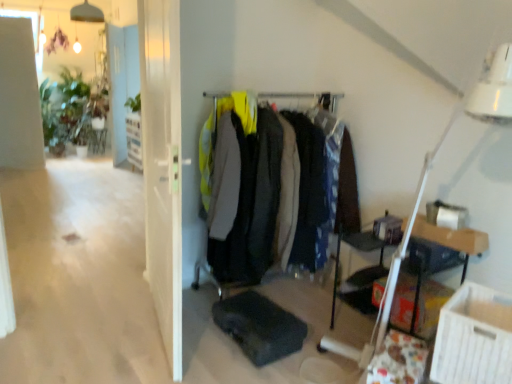
What do you see at coordinates (163, 167) in the screenshot? The height and width of the screenshot is (384, 512). I see `transparent glass door at center` at bounding box center [163, 167].

In order to click on white plastic table lamp at upper right in this screenshot , I will do `click(426, 181)`.

Describe the element at coordinates (134, 140) in the screenshot. The width and height of the screenshot is (512, 384). I see `white glossy shelf at upper center` at that location.

What is the approximate width of white cardboard box at lower right?

It is 14.36 inches.

What do you see at coordinates (452, 238) in the screenshot? I see `wooden table at right` at bounding box center [452, 238].

The width and height of the screenshot is (512, 384). Identify the location of matte black coat rack at center. (306, 98).

You are a GUI agent. You are given a task and a screenshot of the screen. Output one action in this format:
    pyautogui.click(x=<x>, y=<y>)
    Task: Click on the door located above the matte black coat rack at center (from the image's perspective)
    The width and height of the screenshot is (512, 384).
    Given the screenshot: What is the action you would take?
    pyautogui.click(x=117, y=91)

What's the angular difference between white glossy door at upper center and matte black coat rack at center's facing directions?

There is a 65-degree angle between the facing directions of white glossy door at upper center and matte black coat rack at center.

Which is in front, point (115, 147) or point (199, 260)?

Positioned in front is point (199, 260).

Can you confirm if white glossy door at upper center is shorter than matte black coat rack at center?

No, white glossy door at upper center is not shorter than matte black coat rack at center.

From the image's perspective, is white glossy door at upper center positioned above or below wooden table at right?

white glossy door at upper center is above wooden table at right.

Is white glossy door at upper center turned away from wooden table at right?

No, wooden table at right is not at the back of white glossy door at upper center.

Are white glossy door at upper center and wooden table at right making contact?

There is a gap between white glossy door at upper center and wooden table at right.

Considering the sizes of objects white glossy door at upper center and wooden table at right in the image provided, who is taller, white glossy door at upper center or wooden table at right?

Standing taller between the two is white glossy door at upper center.

Which is correct: transparent glass door at center is inside white cardboard box at lower right, or outside of it?

transparent glass door at center is spatially situated outside white cardboard box at lower right.

Locate an element on the screen. The width and height of the screenshot is (512, 384). cardboard box located below the transparent glass door at center (from the image's perspective) is located at coordinates (474, 338).

From a real-world perspective, is transparent glass door at center positioned over white cardboard box at lower right based on gravity?

Yes, from a real-world perspective, transparent glass door at center is on top of white cardboard box at lower right.

Is wooden table at right inside or outside of white glossy shelf at upper center?

wooden table at right is located beyond the bounds of white glossy shelf at upper center.

From a real-world perspective, which is physically above, wooden table at right or white glossy shelf at upper center?

white glossy shelf at upper center, from a real-world perspective.

Is there a large distance between wooden table at right and white glossy shelf at upper center?

That's right, there is a large distance between wooden table at right and white glossy shelf at upper center.

From the picture: Considering the sizes of objects wooden table at right and white glossy shelf at upper center in the image provided, who is shorter, wooden table at right or white glossy shelf at upper center?

wooden table at right is shorter.

From a real-world perspective, which object rests below the other?

white plastic table lamp at upper right is physically lower.

Is point (399, 246) closer or farther from the camera than point (114, 56)?

Point (399, 246) is closer to the camera than point (114, 56).

Could you tell me if white plastic table lamp at upper right is facing white glossy door at upper center?

No.

Who is shorter, white plastic table lamp at upper right or white glossy door at upper center?

Standing shorter between the two is white plastic table lamp at upper right.

What's the angular difference between matte black coat rack at center and green matte plant at upper left's facing directions?

They differ by 83.3 degrees in their facing directions.

Is matte black coat rack at center with green matte plant at upper left?

No.

Locate an element on the screen. This screenshot has height=384, width=512. closet below the green matte plant at upper left (from the image's perspective) is located at coordinates (306, 98).

Is white glossy door at upper center beside white cardboard box at lower right?

No, white glossy door at upper center is not in contact with white cardboard box at lower right.

Consider the image. Does white glossy door at upper center appear on the left side of white cardboard box at lower right?

Yes, white glossy door at upper center is to the left of white cardboard box at lower right.

Considering the sizes of white glossy door at upper center and white cardboard box at lower right in the image, is white glossy door at upper center bigger or smaller than white cardboard box at lower right?

white glossy door at upper center is bigger than white cardboard box at lower right.

Locate an element on the screen. This screenshot has height=384, width=512. cardboard box below the white glossy door at upper center (from a real-world perspective) is located at coordinates (474, 338).

Identify the location of door above the matte black coat rack at center (from the image's perspective). This screenshot has height=384, width=512. (117, 91).

I want to click on table that is under the white glossy door at upper center (from a real-world perspective), so click(452, 238).

Based on their spatial positions, is green matte plant at upper left or white glossy door at upper center further from white plastic table lamp at upper right?

Result: white glossy door at upper center lies further to white plastic table lamp at upper right than the other object.

Considering their positions, is green matte plant at upper left positioned further to wooden table at right than transparent glass door at center?

green matte plant at upper left is positioned further to the anchor wooden table at right.

When comparing their distances from matte black coat rack at center, does white glossy door at upper center or wooden table at right seem closer?

wooden table at right.

Based on their spatial positions, is white plastic table lamp at upper right or matte black coat rack at center closer to white glossy door at upper center?

matte black coat rack at center.

Which object lies nearer to the anchor point matte black coat rack at center, white cardboard box at lower right or wooden table at right?

Based on the image, wooden table at right appears to be nearer to matte black coat rack at center.

When comparing their distances from matte black coat rack at center, does white plastic table lamp at upper right or white glossy door at upper center seem further?

white glossy door at upper center is further to matte black coat rack at center.

When comparing their distances from white cardboard box at lower right, does green matte plant at upper left or wooden table at right seem closer?

The object closer to white cardboard box at lower right is wooden table at right.

Looking at the image, which one is located closer to white cardboard box at lower right, green matte plant at upper left or white glossy door at upper center?

green matte plant at upper left lies closer to white cardboard box at lower right than the other object.

This screenshot has width=512, height=384. Find the location of `closet positioned between wooden table at right and white glossy door at upper center from near to far`. closet positioned between wooden table at right and white glossy door at upper center from near to far is located at coordinates (306, 98).

Identify the location of plant between white glossy door at upper center and white glossy shelf at upper center in the vertical direction. The height and width of the screenshot is (384, 512). (134, 103).

At what (x,y) coordinates should I click in order to perform the action: click on table between white plastic table lamp at upper right and white glossy shelf at upper center along the z-axis. Please return your answer as a coordinate pair (x, y). This screenshot has width=512, height=384. Looking at the image, I should click on (452, 238).

This screenshot has width=512, height=384. I want to click on cardboard box located between white plastic table lamp at upper right and green matte plant at upper left in the depth direction, so click(x=474, y=338).